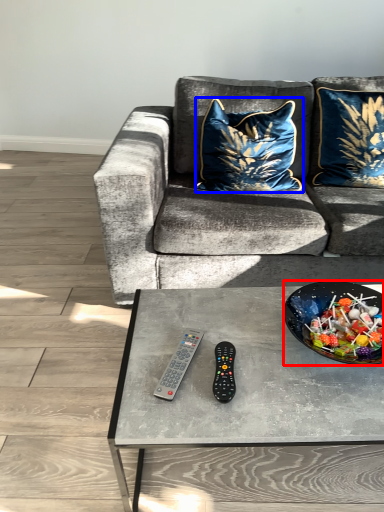
Question: Among these objects, which one is nearest to the camera, bowl (highlighted by a red box) or pillow (highlighted by a blue box)?

Choices:
 (A) bowl
 (B) pillow

Answer: (A)